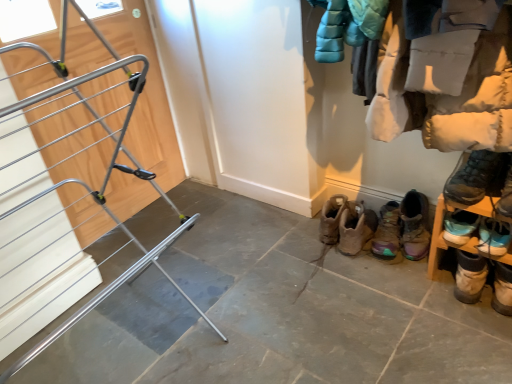
At what (x,y) coordinates should I click in order to perform the action: click on vacant position to the left of multicolored suede boot at lower right, placed as the third footwear when sorted from left to right. Please return your answer as a coordinate pair (x, y). This screenshot has height=384, width=512. Looking at the image, I should click on (370, 273).